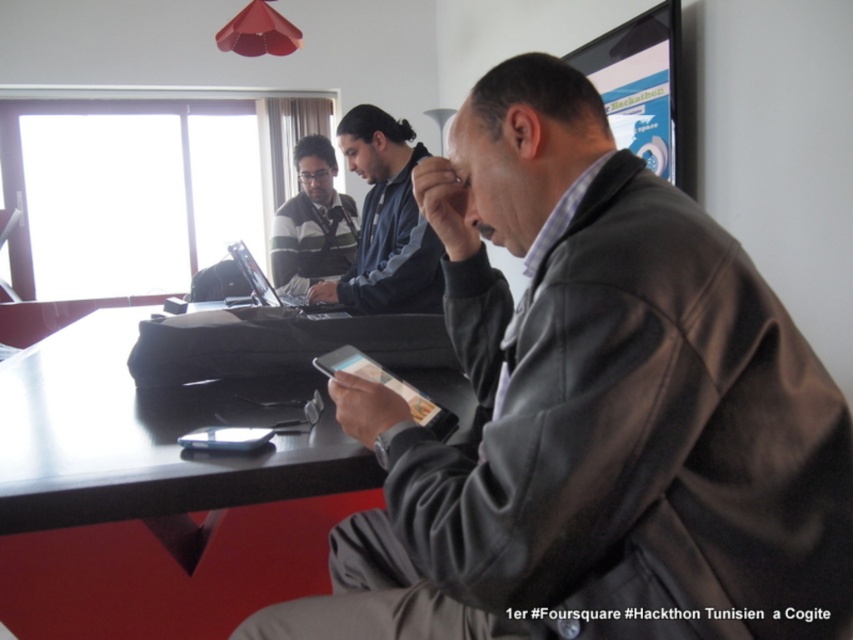
Question: Is dark brown leather jacket at center above dark blue fleece at center?

Choices:
 (A) no
 (B) yes

Answer: (A)

Question: Which of the following is the farthest from the observer?

Choices:
 (A) white glossy phone at lower center
 (B) striped sweater at center
 (C) dark blue fleece at center

Answer: (B)

Question: Does dark blue fleece at center appear on the left side of white glossy phone at lower center?

Choices:
 (A) no
 (B) yes

Answer: (A)

Question: Which point is closer to the camera?

Choices:
 (A) striped sweater at center
 (B) dark blue fleece at center
 (C) dark brown leather jacket at center
 (D) white glossy phone at lower center

Answer: (C)

Question: Among these points, which one is farthest from the camera?

Choices:
 (A) (393, 198)
 (B) (405, 429)
 (C) (321, 180)

Answer: (C)

Question: Can you confirm if dark brown leather jacket at center is positioned below striped sweater at center?

Choices:
 (A) no
 (B) yes

Answer: (B)